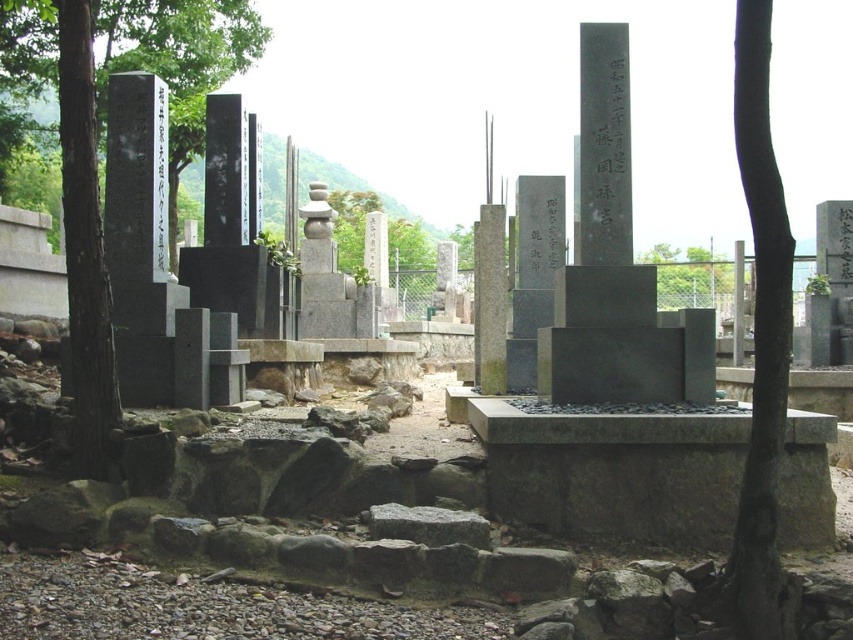
Does black polished stone pillar at center have a greater width compared to green leafy tree at center?

Incorrect, black polished stone pillar at center's width does not surpass green leafy tree at center's.

Does black polished stone pillar at center have a greater height compared to green leafy tree at center?

In fact, black polished stone pillar at center may be shorter than green leafy tree at center.

Locate an element on the screen. black polished stone pillar at center is located at coordinates (224, 172).

Does dark brown bark at center have a smaller size compared to black polished stone marker at center?

Incorrect, dark brown bark at center is not smaller in size than black polished stone marker at center.

Measure the distance between point [755,404] and camera.

Point [755,404] and camera are 99.22 feet apart.

Locate an element on the screen. dark brown bark at center is located at coordinates (759, 336).

Is the position of dark brown bark at center less distant than that of green leafy tree at center?

Yes, dark brown bark at center is in front of green leafy tree at center.

Between point (762, 547) and point (689, 294), which one is positioned behind?

Positioned behind is point (689, 294).

What are the coordinates of `dark brown bark at center` in the screenshot? It's located at (759, 336).